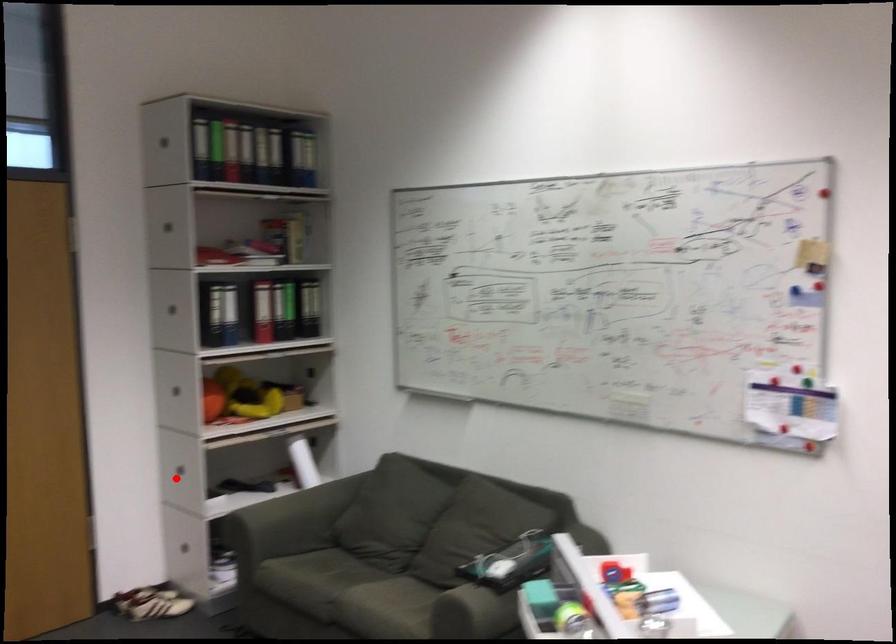
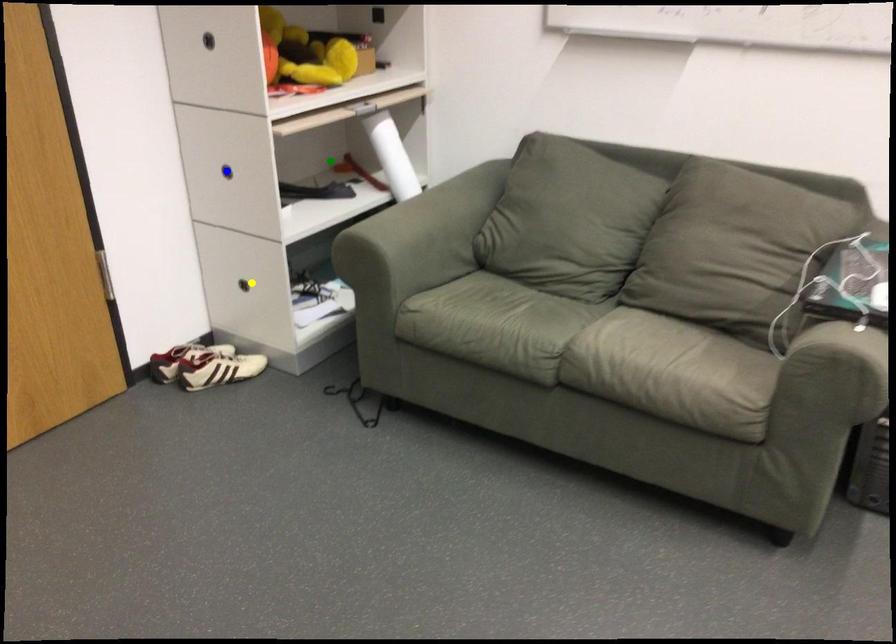
Question: I am providing you with two images of the same scene from different viewpoints. A red point is marked on the first image. You are given multiple points on the second image. Which point in image 2 is actually the same real-world point as the red point in image 1?

Choices:
 (A) yellow point
 (B) green point
 (C) blue point

Answer: (C)